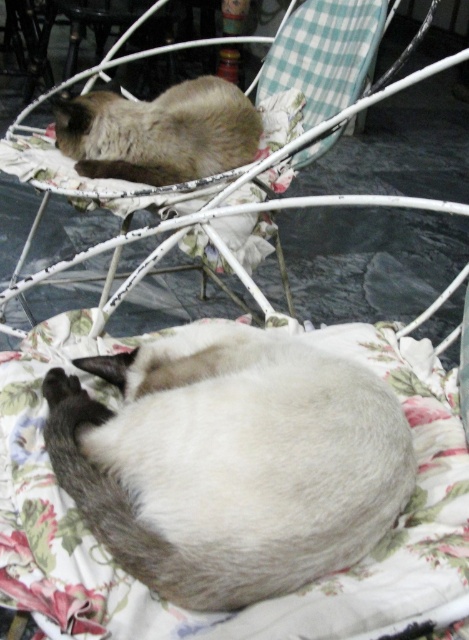
Who is positioned more to the right, silky white cat at center or fluffy fabric chair at upper center?

Positioned to the right is fluffy fabric chair at upper center.

Is point (234, 484) more distant than point (385, 10)?

That is False.

This screenshot has width=469, height=640. Find the location of `silky white cat at center`. silky white cat at center is located at coordinates (231, 461).

Does silky white cat at center lie in front of smokey gray fur at upper left?

Yes, it is.

Does silky white cat at center have a smaller size compared to smokey gray fur at upper left?

Yes, silky white cat at center is smaller than smokey gray fur at upper left.

At what (x,y) coordinates should I click in order to perform the action: click on silky white cat at center. Please return your answer as a coordinate pair (x, y). Looking at the image, I should click on (231, 461).

Between smokey gray fur at upper left and fluffy fabric chair at upper center, which one appears on the right side from the viewer's perspective?

fluffy fabric chair at upper center is more to the right.

Between smokey gray fur at upper left and fluffy fabric chair at upper center, which one appears on the left side from the viewer's perspective?

Positioned to the left is smokey gray fur at upper left.

In order to click on smokey gray fur at upper left in this screenshot , I will do `click(159, 132)`.